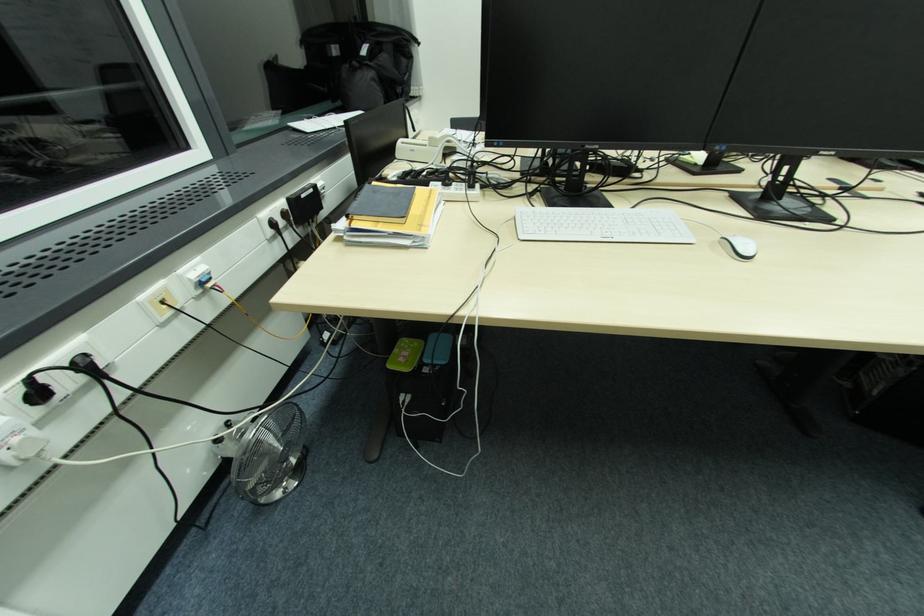
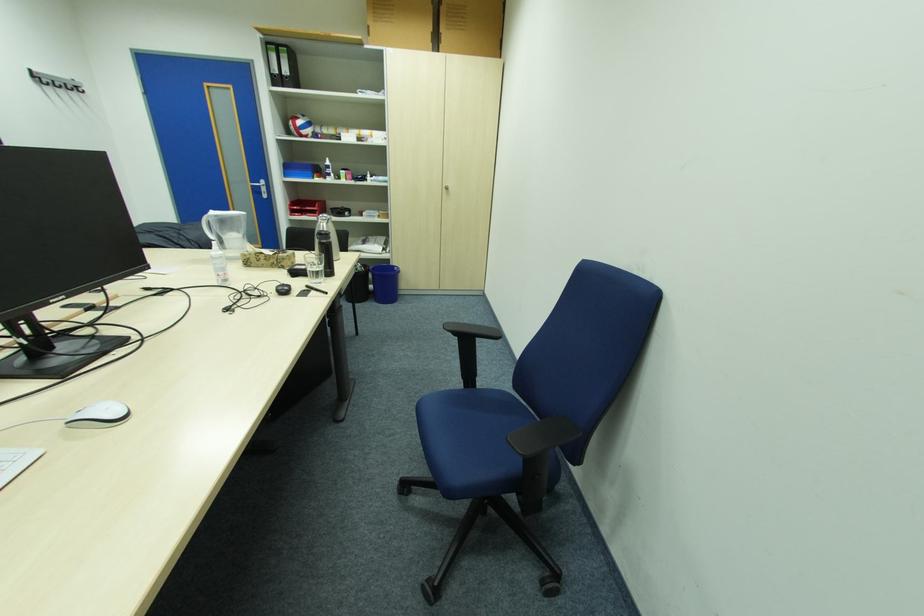
First-person continuous shooting, in which direction is the camera rotating?

The camera's rotation is toward right-down.